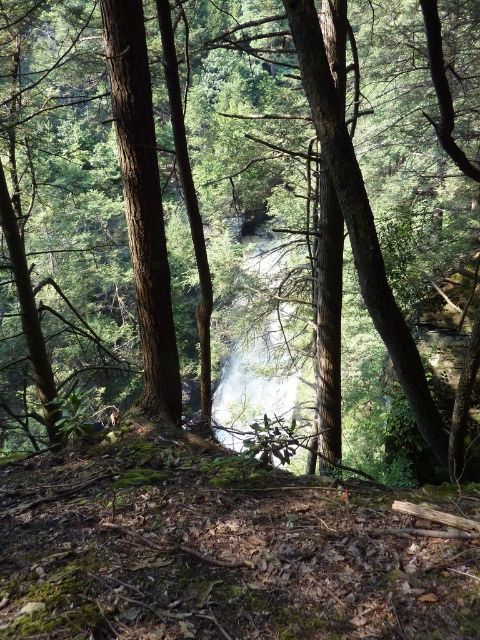
Does smooth brown tree trunk at center have a lesser height compared to white misty waterfall at center?

Indeed, smooth brown tree trunk at center has a lesser height compared to white misty waterfall at center.

Image resolution: width=480 pixels, height=640 pixels. Identify the location of smooth brown tree trunk at center. (143, 204).

Between point (165, 244) and point (259, 291), which one is positioned in front?

Point (165, 244) is in front.

The image size is (480, 640). Identify the location of smooth brown tree trunk at center. (143, 204).